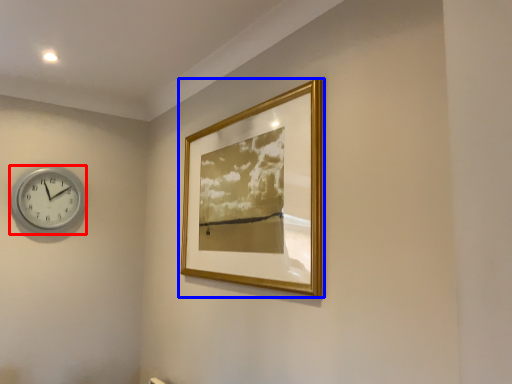
Question: Which object is closer to the camera taking this photo, wall clock (highlighted by a red box) or picture frame (highlighted by a blue box)?

Choices:
 (A) wall clock
 (B) picture frame

Answer: (B)